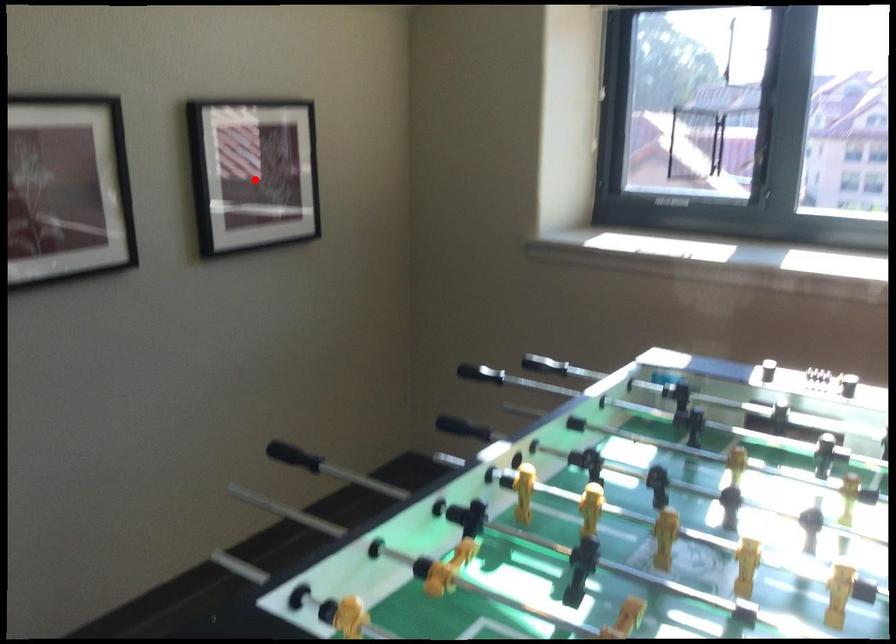
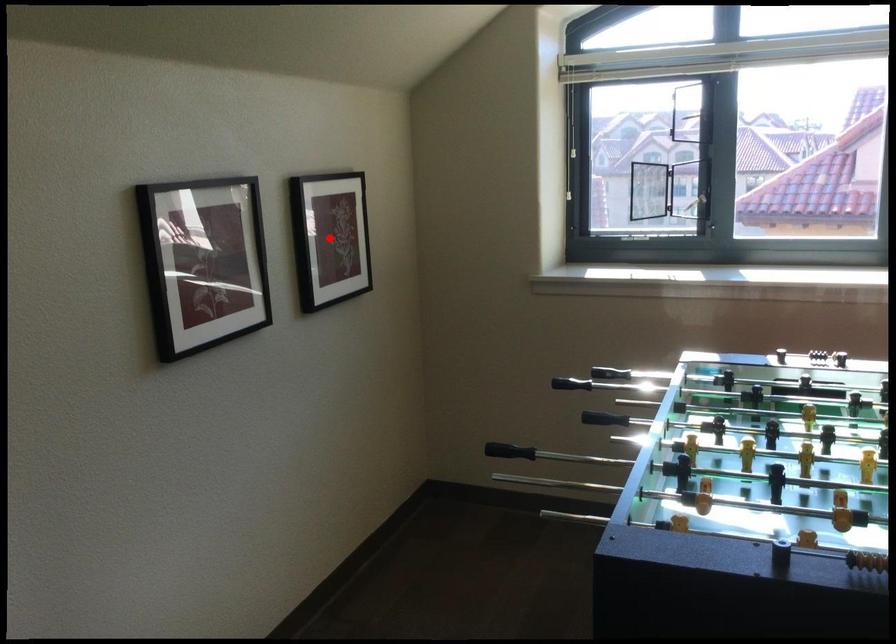
I am providing you with two images of the same scene from different viewpoints. A red point is marked on the first image and another point is marked on the second image. Does the point marked in image1 correspond to the same location as the one in image2?

Yes